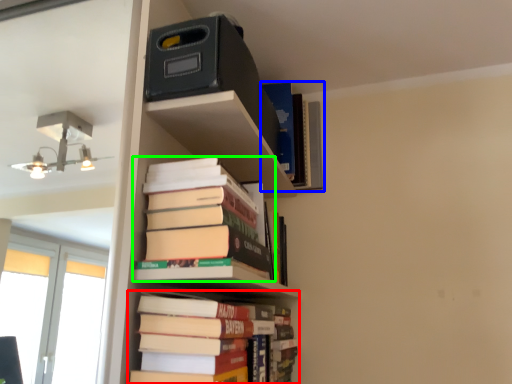
Question: Considering the real-world distances, which object is closest to book (highlighted by a red box)? book (highlighted by a blue box) or book (highlighted by a green box).

Choices:
 (A) book
 (B) book

Answer: (B)